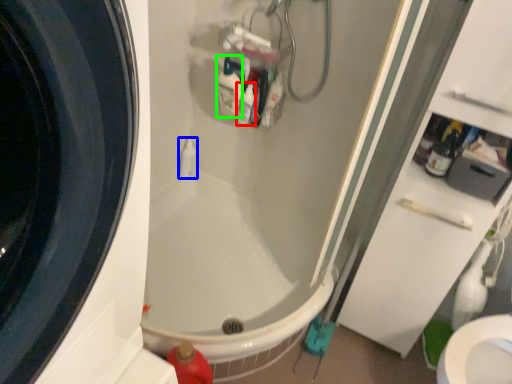
Question: Which is farther away from cleaning product (highlighted by a red box)? toiletry (highlighted by a blue box) or cleaning product (highlighted by a green box)?

Choices:
 (A) toiletry
 (B) cleaning product

Answer: (A)